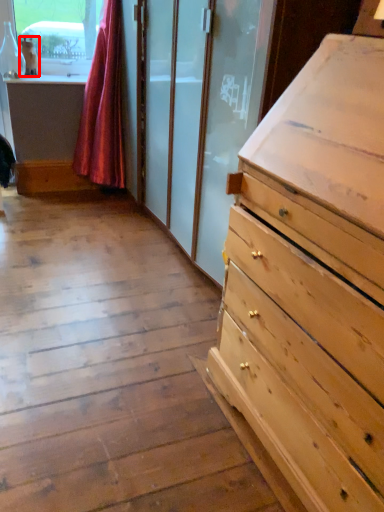
Question: Where is animal (annotated by the red box) located in relation to curtain in the image?

Choices:
 (A) left
 (B) right

Answer: (A)